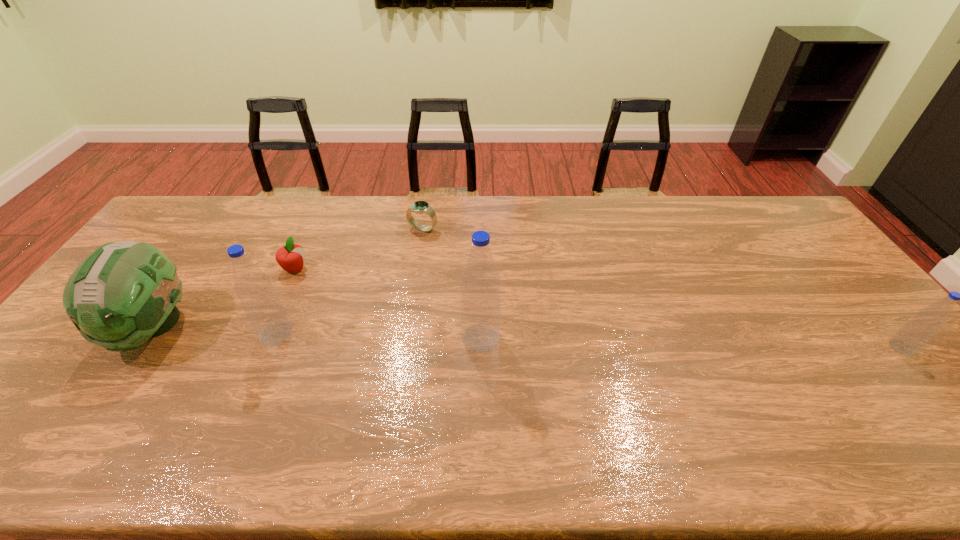
This screenshot has width=960, height=540. What are the coordinates of `vacant space at the near edge of the desktop` in the screenshot? It's located at click(428, 416).

Where is `free location at the right edge`? This screenshot has height=540, width=960. free location at the right edge is located at coordinates (829, 269).

The width and height of the screenshot is (960, 540). I want to click on vacant point located between the leftmost object and the farthest object, so click(x=288, y=278).

Where is `vacant space that's between the leftmost water bottle and the second farthest object`? vacant space that's between the leftmost water bottle and the second farthest object is located at coordinates [x=285, y=301].

The height and width of the screenshot is (540, 960). Identify the location of free spot between the watch and the fourth tallest object. (662, 288).

At what (x,y) coordinates should I click in order to perform the action: click on free space between the second water bottle from right to left and the third tallest object. Please return your answer as a coordinate pair (x, y). This screenshot has height=540, width=960. Looking at the image, I should click on (317, 333).

Identify the location of vacant space in between the third object from right to left and the leftmost water bottle. This screenshot has width=960, height=540. (349, 281).

Where is `vacant area that lies between the third object from right to left and the second water bottle from left to right`? This screenshot has width=960, height=540. vacant area that lies between the third object from right to left and the second water bottle from left to right is located at coordinates coord(452,284).

What are the coordinates of `free point between the fifth object from left to right and the leftmost water bottle` in the screenshot? It's located at (378, 335).

Where is `vacant area that lies between the watch and the second object from right to left`? vacant area that lies between the watch and the second object from right to left is located at coordinates (452, 284).